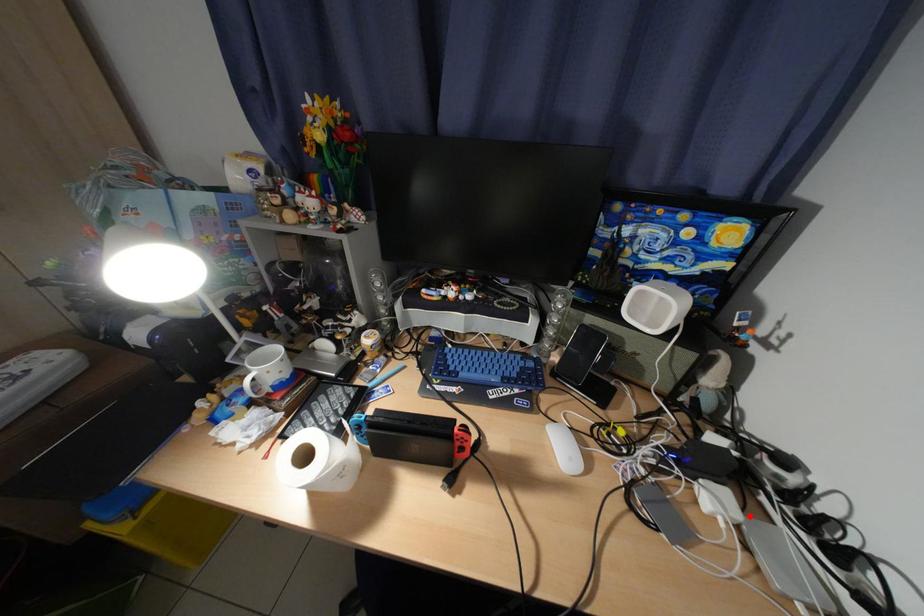
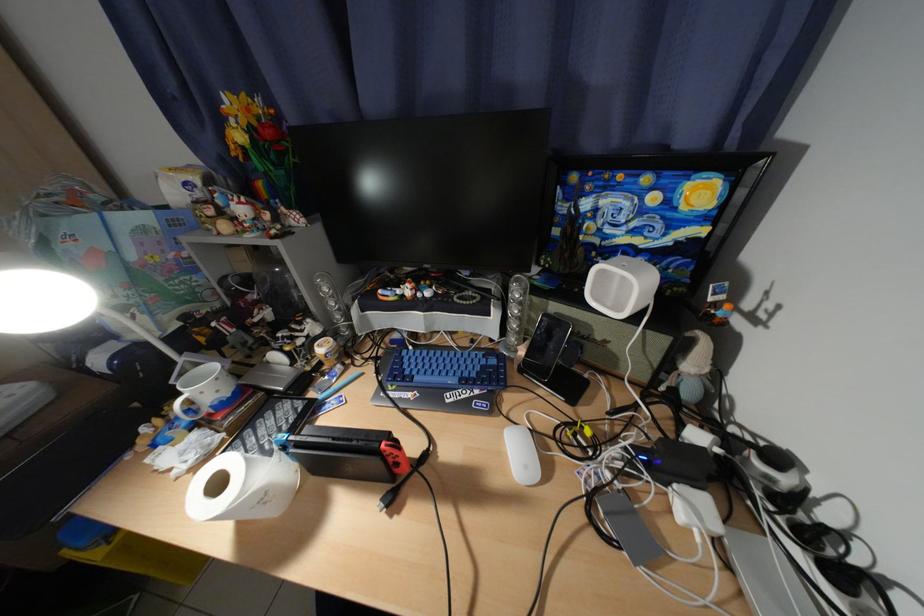
In the second image, find the point that corresponds to the highlighted location in the first image.

(728, 528)